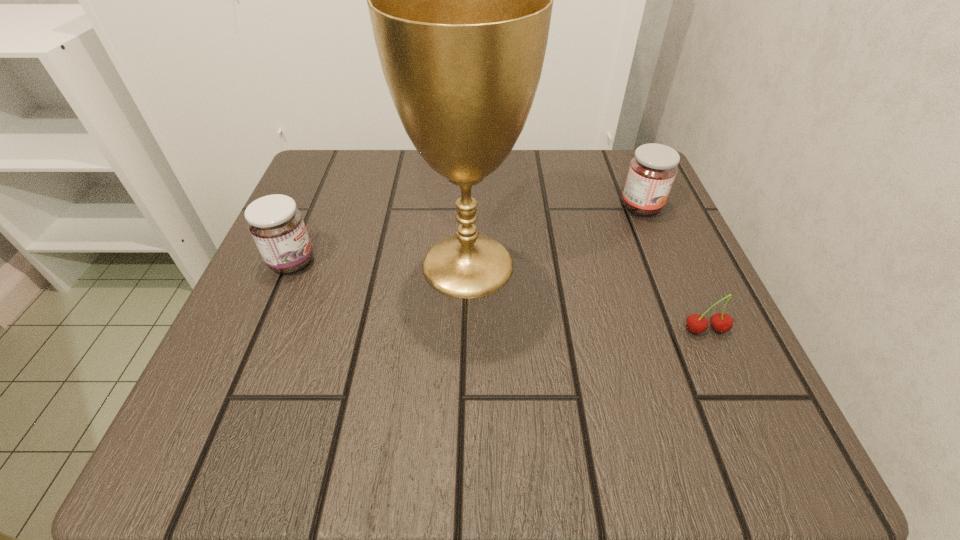
Identify which object is the second nearest to the right jam. Please provide its 2D coordinates. Your answer should be formatted as a tuple, i.e. [(x, y)], where the tuple contains the x and y coordinates of a point satisfying the conditions above.

[(720, 322)]

This screenshot has height=540, width=960. Identify the location of object that is the third closest to the nearer jam. (720, 322).

Find the location of a particular element. vacant point that satisfies the following two spatial constraints: 1. on the front side of the farther jam; 2. on the front label of the nearer jam is located at coordinates (664, 262).